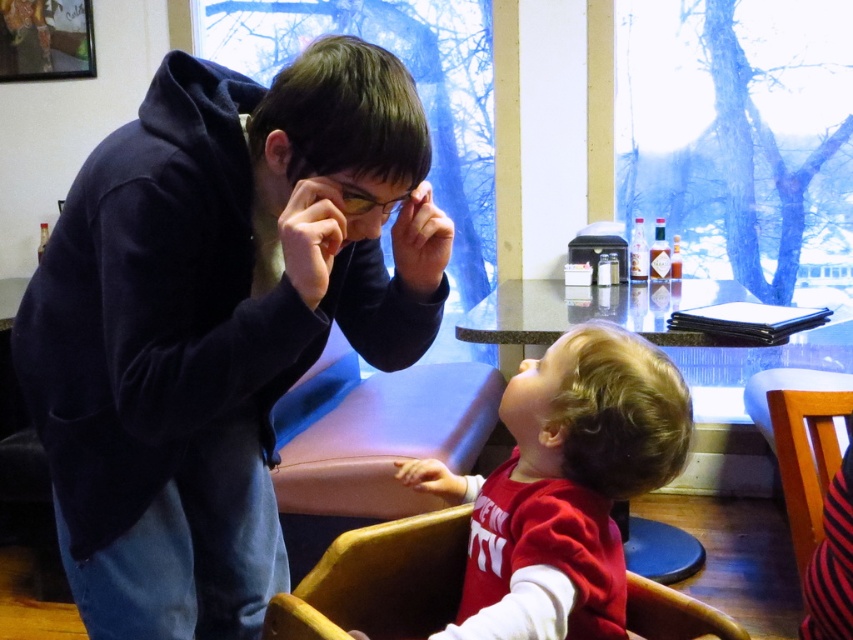
Consider the image. You are a photographer trying to capture the scene from the upper left corner. The dark blue hoodie at upper left is an important subject. Where exactly should you position your camera to ensure it is centered in the frame?

To center the dark blue hoodie at upper left in your frame, position your camera so it aligns with the coordinates point [218,321].

You are standing in the cafe and want to take a photo of the man in the dark hoodie and the point at coordinate (71,310). Can you fit both subjects in your camera frame if your camera has a 1.5 meter wide field of view?

The point at coordinate (71,310) is 1.10 meters away from the viewer. Since the camera has a 1.5 meter wide field of view, which is wider than the distance between the two subjects, both the man in the dark hoodie and the point at coordinate (71,310) can be captured in the same frame.

You are a photographer trying to capture a candid shot of the dark blue hoodie at upper left and the matte red shirt at lower center. Which object should you focus on first if you want to ensure both are in focus without moving the camera?

The dark blue hoodie at upper left is above the matte red shirt at lower center, so you should focus on the dark blue hoodie at upper left first to ensure both are in focus since it is closer to the camera.